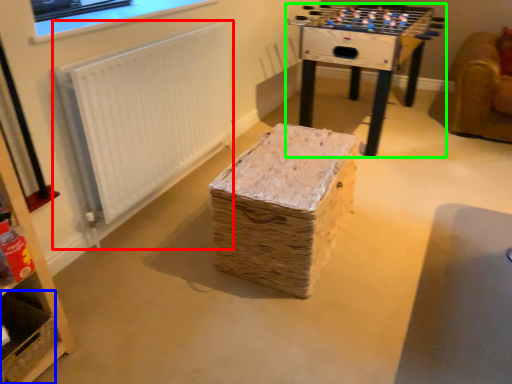
Question: Which is farther away from radiator (highlighted by a red box)? basket (highlighted by a blue box) or table (highlighted by a green box)?

Choices:
 (A) basket
 (B) table

Answer: (B)